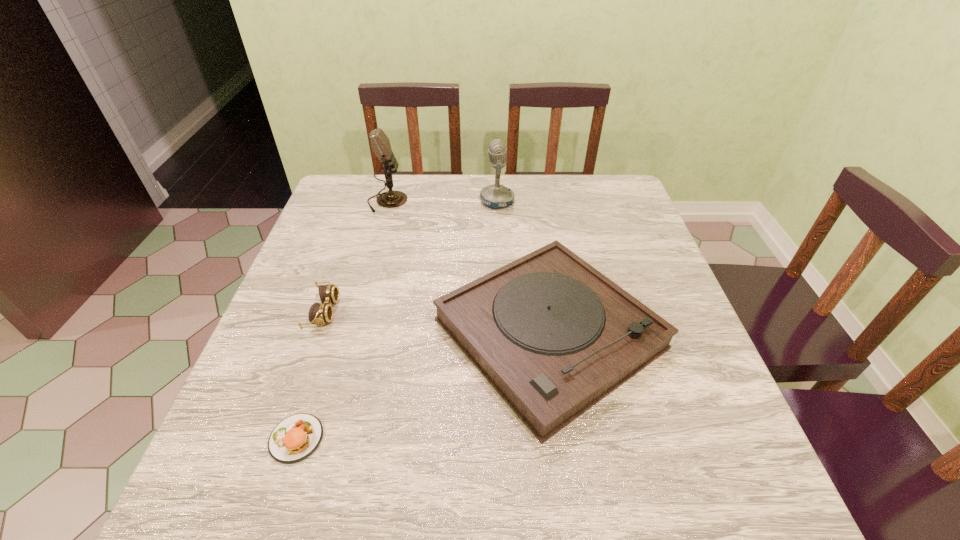
Find the location of a particular element. This screenshot has width=960, height=540. free space in the image that satisfies the following two spatial constraints: 1. on the front-facing side of the third tallest object; 2. on the left side of the right microphone is located at coordinates (504, 334).

The height and width of the screenshot is (540, 960). Identify the location of free region that satisfies the following two spatial constraints: 1. through the lenses of the shortest object; 2. on the right side of the fourth tallest object. (279, 438).